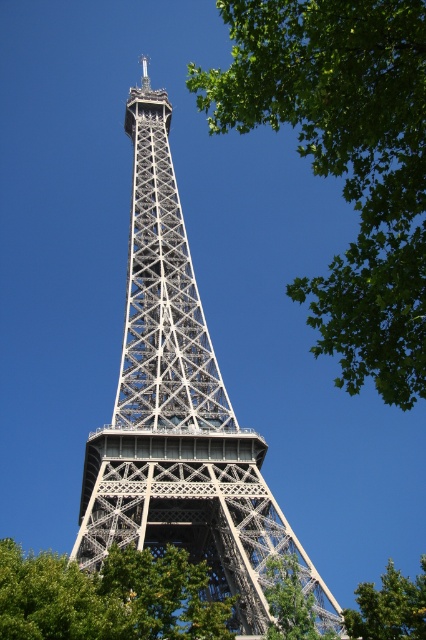
Between green leafy tree at upper right and metallic lattice tower at center, which one appears on the left side from the viewer's perspective?

From the viewer's perspective, metallic lattice tower at center appears more on the left side.

Is green leafy tree at upper right closer to camera compared to metallic lattice tower at center?

That is True.

Which is in front, point (414, 305) or point (233, 486)?

Point (414, 305) is in front.

Find the location of `green leafy tree at upper right`. green leafy tree at upper right is located at coordinates (345, 161).

Between point (311, 284) and point (391, 636), which one is positioned behind?

The point (311, 284) is more distant.

Which is above, green leafy tree at upper right or green leafy tree at center?

green leafy tree at upper right is higher up.

Is point (376, 81) closer to viewer compared to point (423, 589)?

Yes, point (376, 81) is closer to viewer.

I want to click on green leafy tree at upper right, so click(345, 161).

Who is shorter, metallic lattice tower at center or green leafy tree at center?

green leafy tree at center

Does metallic lattice tower at center have a lesser width compared to green leafy tree at center?

Indeed, metallic lattice tower at center has a lesser width compared to green leafy tree at center.

Between point (204, 445) and point (388, 561), which one is positioned in front?

Point (204, 445)

Where is `metallic lattice tower at center`? The image size is (426, 640). metallic lattice tower at center is located at coordinates (180, 413).